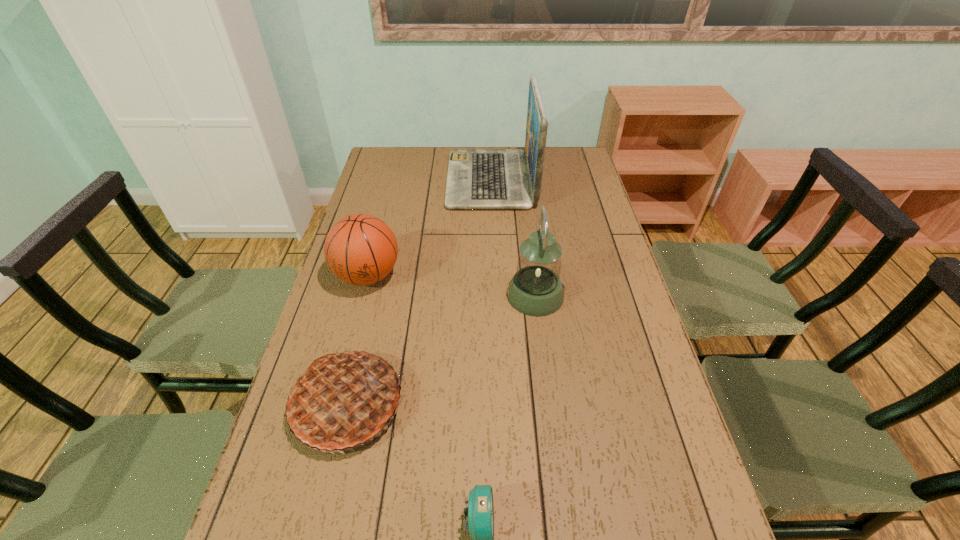
You are a GUI agent. You are given a task and a screenshot of the screen. Output one action in this format:
    pyautogui.click(x=<x>, y=<y>)
    Task: Click on the laptop computer
    
    Given the screenshot: What is the action you would take?
    pyautogui.click(x=477, y=178)

Where is `lantern`? The height and width of the screenshot is (540, 960). lantern is located at coordinates (536, 290).

Identify the location of basketball. The width and height of the screenshot is (960, 540). (360, 249).

Find the location of a particular element. The width and height of the screenshot is (960, 540). the fourth farthest object is located at coordinates (345, 399).

Locate an element on the screen. The height and width of the screenshot is (540, 960). vacant space located 0.210m on the screen of the laptop computer is located at coordinates (396, 180).

At what (x,y) coordinates should I click in order to perform the action: click on free point located 0.270m on the screen of the laptop computer. Please return your answer as a coordinate pair (x, y). This screenshot has width=960, height=540. Looking at the image, I should click on (380, 180).

Locate an element on the screen. The width and height of the screenshot is (960, 540). vacant region located 0.250m on the screen of the laptop computer is located at coordinates (386, 180).

Identify the location of free space located 0.220m on the front of the second tallest object. (546, 384).

Find the location of a particular element. This screenshot has height=540, width=960. free space located on the right of the basketball is located at coordinates (511, 276).

At what (x,y) coordinates should I click in order to perform the action: click on free spot located 0.250m on the back of the pie. Please return your answer as a coordinate pair (x, y). The width and height of the screenshot is (960, 540). Looking at the image, I should click on (374, 291).